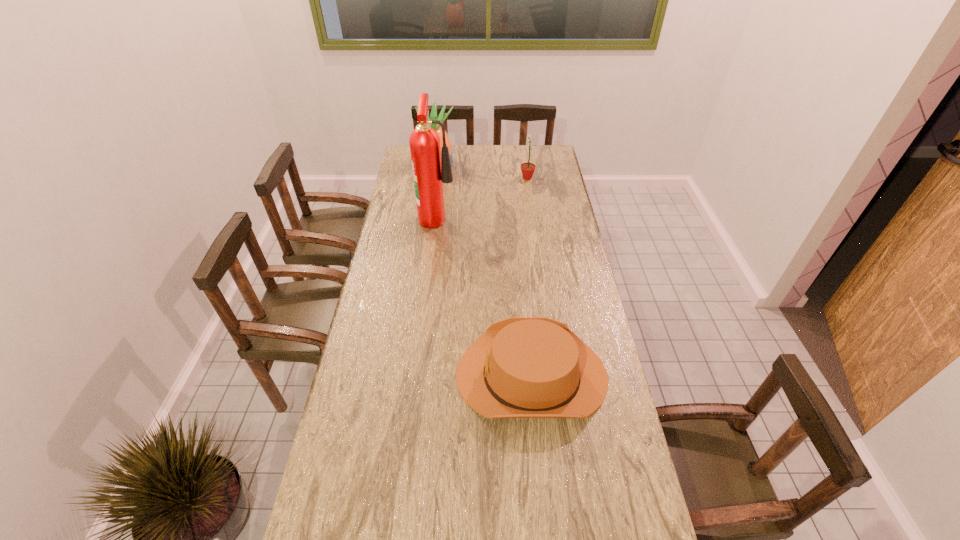
I want to click on free space located on the face of the second shortest object, so click(452, 178).

At what (x,y) coordinates should I click in order to perform the action: click on free space located on the front-facing side of the cowboy hat. Please return your answer as a coordinate pair (x, y). Looking at the image, I should click on (426, 375).

You are a GUI agent. You are given a task and a screenshot of the screen. Output one action in this format:
    pyautogui.click(x=<x>, y=<y>)
    Task: Click on the free spot located on the front-facing side of the cowboy hat
    The image size is (960, 540).
    Given the screenshot: What is the action you would take?
    pyautogui.click(x=403, y=375)

You are a GUI agent. You are given a task and a screenshot of the screen. Output one action in this format:
    pyautogui.click(x=<x>, y=<y>)
    Task: Click on the free location located 0.070m on the front-facing side of the cowboy hat
    
    Given the screenshot: What is the action you would take?
    pyautogui.click(x=433, y=375)

Where is `object at the far edge`? object at the far edge is located at coordinates (433, 116).

Image resolution: width=960 pixels, height=540 pixels. I want to click on fire extinguisher that is positioned at the left edge, so click(x=429, y=171).

Where is `pineapple at the left edge`? pineapple at the left edge is located at coordinates (433, 116).

At what (x,y) coordinates should I click in order to perform the action: click on sunflower present at the right edge. Please return your answer as a coordinate pair (x, y). Looking at the image, I should click on (527, 169).

You are a GUI agent. You are given a task and a screenshot of the screen. Output one action in this format:
    pyautogui.click(x=<x>, y=<y>)
    Task: Click on the cowboy hat that is at the right edge
    This screenshot has height=540, width=960.
    Given the screenshot: What is the action you would take?
    pyautogui.click(x=521, y=367)

Where is `object that is positioned at the far left corner`? Image resolution: width=960 pixels, height=540 pixels. object that is positioned at the far left corner is located at coordinates 433,116.